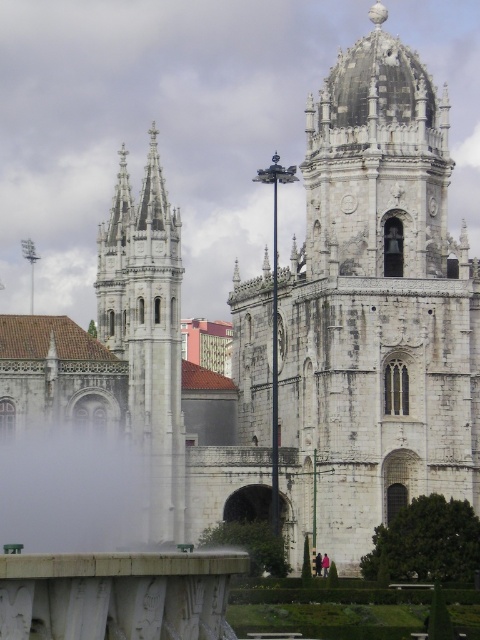
You are an architect visiting this historic site. You need to place a temporary structure that requires a space wider than the white fog at lower center. Can the white stone tower at left provide enough space for this requirement?

The white stone tower at left is wider than the white fog at lower center, so yes, the white stone tower at left can provide enough space for the temporary structure.

You are standing in front of the historic building and notice the white stone tower at left and the white fog at lower center. From your perspective, which object is positioned to the right side?

The white stone tower at left is to the right of white fog at lower center, so the white stone tower at left is positioned to the right side.

You are standing at the center of the image. Which direction should you face to look directly at the white stone tower at left?

You should face to the left to look directly at the white stone tower at left since it is located at the left side of the image.